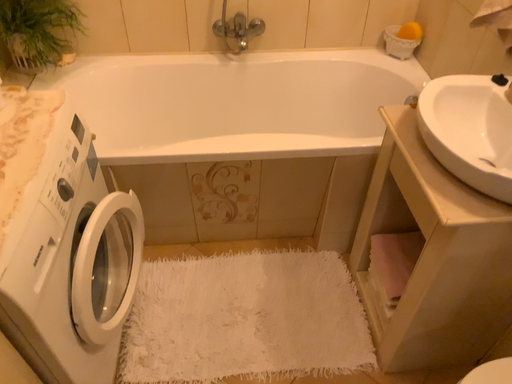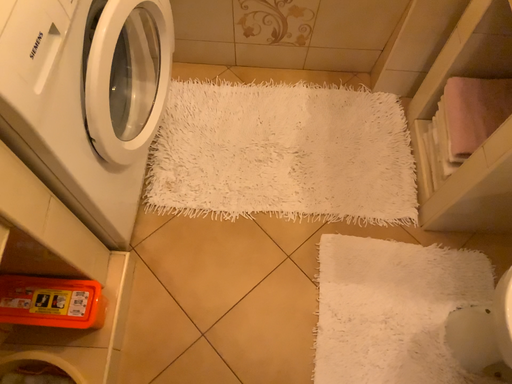
Question: How did the camera likely rotate when shooting the video?

Choices:
 (A) rotated downward
 (B) rotated upward

Answer: (A)